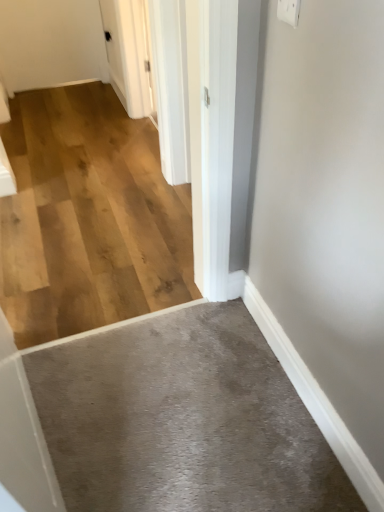
Measure the distance between white plastic electric outlet at upper right and camera.

A distance of 37.32 inches exists between white plastic electric outlet at upper right and camera.

Identify the location of white glossy door at upper center. The width and height of the screenshot is (384, 512). (170, 86).

Where is `white plastic electric outlet at upper right`? white plastic electric outlet at upper right is located at coordinates (289, 11).

Which object is thinner, natural wood flooring at center, the first concrete from the back, or white plastic electric outlet at upper right?

white plastic electric outlet at upper right.

Is natural wood flooring at center, the first concrete from the back, positioned behind white plastic electric outlet at upper right?

That is True.

Can you confirm if natural wood flooring at center, positioned as the 2th concrete in front-to-back order, is smaller than white plastic electric outlet at upper right?

No, natural wood flooring at center, positioned as the 2th concrete in front-to-back order, is not smaller than white plastic electric outlet at upper right.

Is white glossy door at upper center wider or thinner than white plastic electric outlet at upper right?

In the image, white glossy door at upper center appears to be wider than white plastic electric outlet at upper right.

From a real-world perspective, who is located lower, white glossy door at upper center or white plastic electric outlet at upper right?

white glossy door at upper center, from a real-world perspective.

From the image's perspective, does white glossy door at upper center appear lower than white plastic electric outlet at upper right?

No, from the image's perspective, white glossy door at upper center is not below white plastic electric outlet at upper right.

Considering the sizes of objects gray carpet at lower center, positioned as the 2th concrete in back-to-front order, and white glossy door at upper center in the image provided, who is taller, gray carpet at lower center, positioned as the 2th concrete in back-to-front order, or white glossy door at upper center?

With more height is white glossy door at upper center.

Looking at this image, who is smaller, gray carpet at lower center, the first concrete when ordered from front to back, or white glossy door at upper center?

gray carpet at lower center, the first concrete when ordered from front to back.

Is gray carpet at lower center, positioned as the 2th concrete in back-to-front order, positioned with its back to white glossy door at upper center?

That's not correct — gray carpet at lower center, positioned as the 2th concrete in back-to-front order, is not looking away from white glossy door at upper center.

Measure the distance between natural wood flooring at center, which is counted as the first concrete, starting from the top, and white glossy door at upper center.

natural wood flooring at center, which is counted as the first concrete, starting from the top, is 24.73 inches away from white glossy door at upper center.

Considering the relative sizes of natural wood flooring at center, positioned as the 2th concrete in front-to-back order, and white glossy door at upper center in the image provided, is natural wood flooring at center, positioned as the 2th concrete in front-to-back order, thinner than white glossy door at upper center?

No, natural wood flooring at center, positioned as the 2th concrete in front-to-back order, is not thinner than white glossy door at upper center.

Is natural wood flooring at center, the first concrete from the back, not near white glossy door at upper center?

natural wood flooring at center, the first concrete from the back, is near white glossy door at upper center, not far away.

In the image, is natural wood flooring at center, the 2th concrete in the bottom-to-top sequence, positioned in front of or behind white glossy door at upper center?

natural wood flooring at center, the 2th concrete in the bottom-to-top sequence, is positioned closer to the viewer than white glossy door at upper center.

Consider the image. Is white glossy door at upper center positioned far away from gray carpet at lower center, the second concrete when ordered from top to bottom?

white glossy door at upper center is positioned a significant distance from gray carpet at lower center, the second concrete when ordered from top to bottom.

How distant is white glossy door at upper center from gray carpet at lower center, which appears as the 1th concrete when ordered from the bottom?

The distance of white glossy door at upper center from gray carpet at lower center, which appears as the 1th concrete when ordered from the bottom, is 1.05 meters.

Based on their positions, is white glossy door at upper center located to the left or right of gray carpet at lower center, which appears as the 1th concrete when ordered from the bottom?

From the image, it's evident that white glossy door at upper center is to the left of gray carpet at lower center, which appears as the 1th concrete when ordered from the bottom.

From the picture: From the image's perspective, is white glossy door at upper center above or below gray carpet at lower center, the first concrete when ordered from front to back?

Clearly, from the image's perspective, white glossy door at upper center is above gray carpet at lower center, the first concrete when ordered from front to back.

Which is in front, gray carpet at lower center, which appears as the 1th concrete when ordered from the bottom, or natural wood flooring at center, positioned as the 2th concrete in front-to-back order?

Positioned in front is gray carpet at lower center, which appears as the 1th concrete when ordered from the bottom.

Considering the positions of points (275, 420) and (178, 302), is point (275, 420) farther from camera compared to point (178, 302)?

No, it is not.

Does gray carpet at lower center, the first concrete when ordered from front to back, have a greater width compared to natural wood flooring at center, the 2th concrete in the bottom-to-top sequence?

No, gray carpet at lower center, the first concrete when ordered from front to back, is not wider than natural wood flooring at center, the 2th concrete in the bottom-to-top sequence.

From a real-world perspective, is white plastic electric outlet at upper right positioned above or below natural wood flooring at center, the 2th concrete in the bottom-to-top sequence?

From a real-world perspective, white plastic electric outlet at upper right is physically above natural wood flooring at center, the 2th concrete in the bottom-to-top sequence.

Is point (285, 3) less distant than point (147, 156)?

Yes.

Does white plastic electric outlet at upper right appear on the right side of natural wood flooring at center, the first concrete from the back?

Yes, white plastic electric outlet at upper right is to the right of natural wood flooring at center, the first concrete from the back.

Is white plastic electric outlet at upper right bigger than natural wood flooring at center, the 2th concrete in the bottom-to-top sequence?

No.

Where is `the 2nd concrete counting from the left of the white plastic electric outlet at upper right`? the 2nd concrete counting from the left of the white plastic electric outlet at upper right is located at coordinates (88, 217).

The image size is (384, 512). In order to click on electric outlet in front of the white glossy door at upper center in this screenshot , I will do `click(289, 11)`.

Considering their positions, is natural wood flooring at center, positioned as the 2th concrete in front-to-back order, positioned closer to white plastic electric outlet at upper right than white glossy door at upper center?

white glossy door at upper center is closer to white plastic electric outlet at upper right.

Estimate the real-world distances between objects in this image. Which object is further from gray carpet at lower center, the second concrete when ordered from top to bottom, natural wood flooring at center, the first concrete from the back, or white plastic electric outlet at upper right?

white plastic electric outlet at upper right is positioned further to the anchor gray carpet at lower center, the second concrete when ordered from top to bottom.

Based on their spatial positions, is white plastic electric outlet at upper right or gray carpet at lower center, the second concrete when ordered from top to bottom, further from white glossy door at upper center?

The object further to white glossy door at upper center is gray carpet at lower center, the second concrete when ordered from top to bottom.

Consider the image. Which object lies further to the anchor point gray carpet at lower center, which appears as the 1th concrete when ordered from the bottom, natural wood flooring at center, positioned as the 2th concrete in front-to-back order, or white glossy door at upper center?

Among the two, white glossy door at upper center is located further to gray carpet at lower center, which appears as the 1th concrete when ordered from the bottom.

From the image, which object appears to be farther from natural wood flooring at center, the first concrete from the back, gray carpet at lower center, positioned as the 2th concrete in back-to-front order, or white plastic electric outlet at upper right?

Among the two, white plastic electric outlet at upper right is located further to natural wood flooring at center, the first concrete from the back.

When comparing their distances from natural wood flooring at center, positioned as the 2th concrete in front-to-back order, does white plastic electric outlet at upper right or gray carpet at lower center, positioned as the 2th concrete in back-to-front order, seem further?

white plastic electric outlet at upper right is further to natural wood flooring at center, positioned as the 2th concrete in front-to-back order.

Consider the image. Estimate the real-world distances between objects in this image. Which object is further from white plastic electric outlet at upper right, white glossy door at upper center or natural wood flooring at center, positioned as the 2th concrete in front-to-back order?

natural wood flooring at center, positioned as the 2th concrete in front-to-back order, is further to white plastic electric outlet at upper right.

From the image, which object appears to be nearer to white glossy door at upper center, gray carpet at lower center, the second concrete when ordered from top to bottom, or white plastic electric outlet at upper right?

The object closer to white glossy door at upper center is white plastic electric outlet at upper right.

Find the location of `electric outlet between white glossy door at upper center and gray carpet at lower center, which appears as the 1th concrete when ordered from the bottom, from top to bottom`. electric outlet between white glossy door at upper center and gray carpet at lower center, which appears as the 1th concrete when ordered from the bottom, from top to bottom is located at coordinates (289, 11).

Locate an element on the screen. This screenshot has height=512, width=384. electric outlet between natural wood flooring at center, which is counted as the first concrete, starting from the top, and gray carpet at lower center, the first concrete when ordered from front to back, in the up-down direction is located at coordinates (289, 11).

At what (x,y) coordinates should I click in order to perform the action: click on concrete between white glossy door at upper center and gray carpet at lower center, the second concrete when ordered from top to bottom, in the up-down direction. Please return your answer as a coordinate pair (x, y). The image size is (384, 512). Looking at the image, I should click on (88, 217).